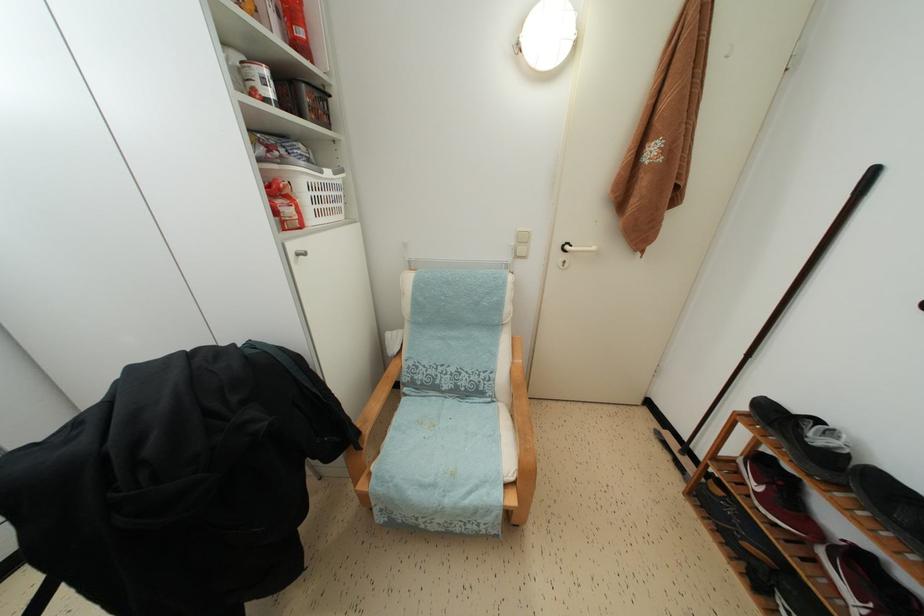
Locate an element on the screen. The width and height of the screenshot is (924, 616). brown towel is located at coordinates (663, 131).